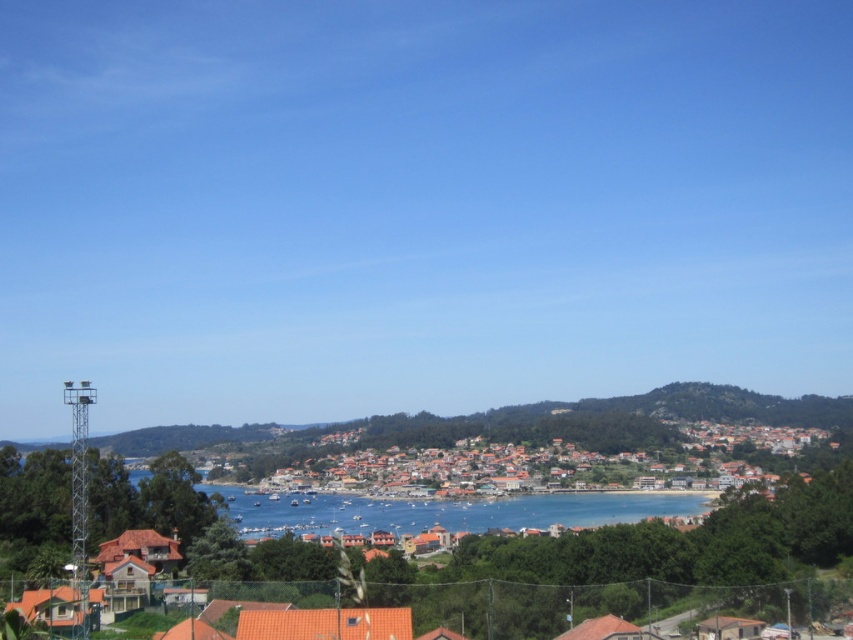
You are standing at the point with coordinates point (306, 520) and want to walk to the point with coordinates point (814, 432). According to the scene, will the path between them be obstructed by any structures or objects?

The point (814, 432) is behind point (306, 520), so the path between them may be obstructed by structures or objects in the scene.

You are a tourist standing at the edge of the harbor looking towards the town. You notice the orange tiled roofs at center and the blue water at center. Which one appears taller from your vantage point?

The blue water at center appears taller than the orange tiled roofs at center because the orange tiled roofs at center is not as tall as blue water at center.

You are standing at the edge of the harbor looking towards the town. You want to know how far the orange tiled roofs at center are from your current position. What is the approximate distance?

The orange tiled roofs at center are approximately 218.87 meters away from the viewer.